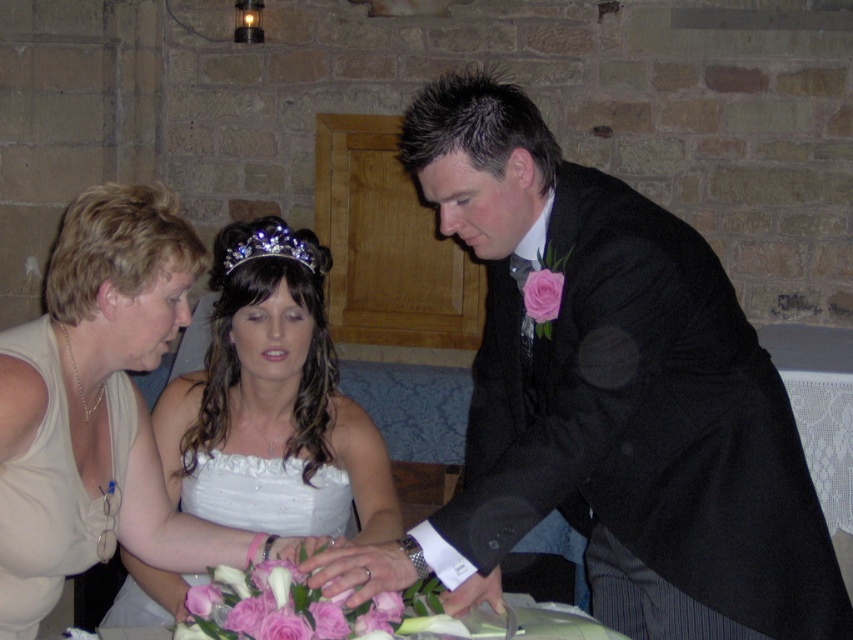
Question: Is matte black suit at center positioned behind swarthy crystal tiara at center?

Choices:
 (A) yes
 (B) no

Answer: (B)

Question: Is matte black suit at center to the right of white satin wedding dress at center from the viewer's perspective?

Choices:
 (A) no
 (B) yes

Answer: (B)

Question: Is white satin dress at center behind white satin wedding dress at center?

Choices:
 (A) yes
 (B) no

Answer: (B)

Question: Which object is positioned farthest from the matte black suit at center?

Choices:
 (A) white satin dress at center
 (B) white satin wedding dress at center
 (C) swarthy crystal tiara at center

Answer: (C)

Question: Which object appears closest to the camera in this image?

Choices:
 (A) matte black suit at center
 (B) white satin wedding dress at center

Answer: (A)

Question: Which object is the closest to the matte black suit at center?

Choices:
 (A) swarthy crystal tiara at center
 (B) white satin dress at center
 (C) white satin wedding dress at center

Answer: (B)